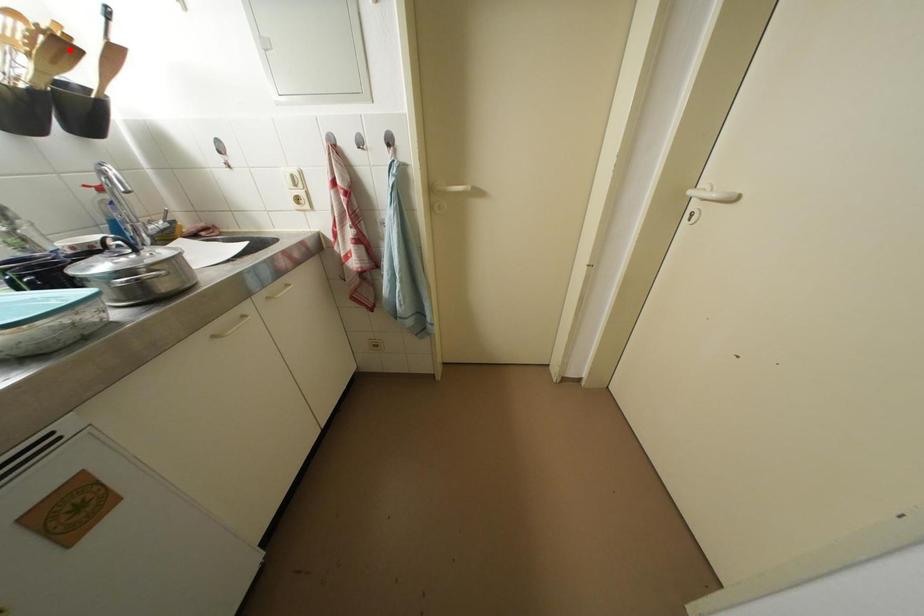
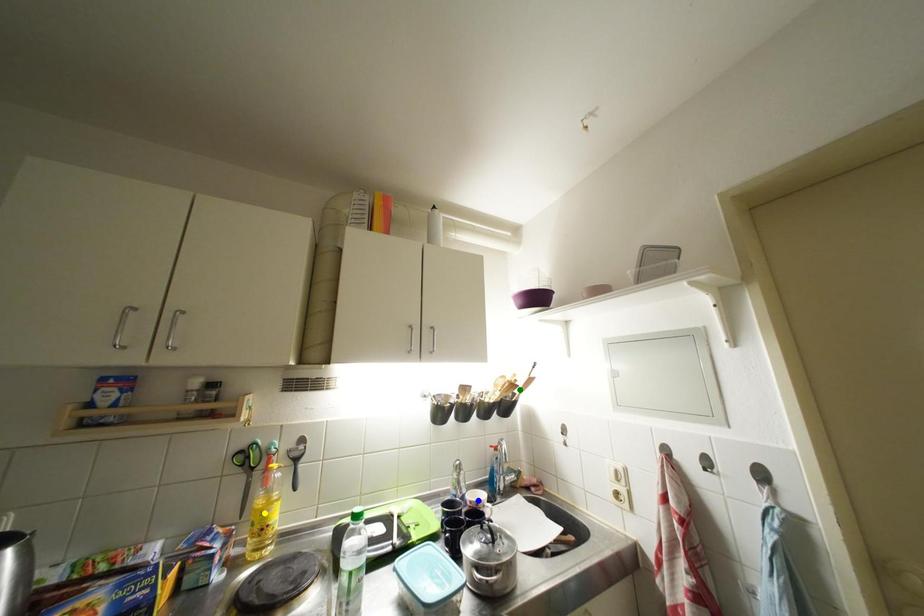
Question: I am providing you with two images of the same scene from different viewpoints. A red point is marked on the first image. You are given multiple points on the second image. Can you choose the point in image 2 that corresponds to the point in image 1?

Choices:
 (A) blue point
 (B) yellow point
 (C) green point

Answer: (C)